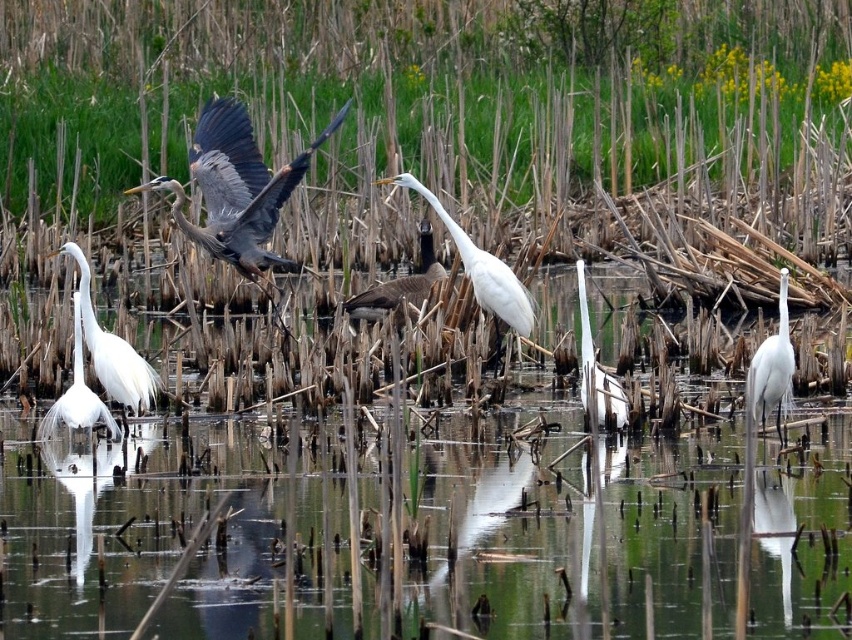
Question: Which object appears farthest from the camera in this image?

Choices:
 (A) white matte heron at center
 (B) white matte egret at lower left

Answer: (B)

Question: Observing the image, what is the correct spatial positioning of white matte egret at lower left in reference to white matte heron at center?

Choices:
 (A) right
 (B) left

Answer: (B)

Question: Which object is closer to the camera taking this photo?

Choices:
 (A) brown matte goose at center
 (B) white matte bird at center
 (C) white smooth heron at right
 (D) clear water at center

Answer: (D)

Question: Is white matte egret at lower left to the right of white matte heron at lower left from the viewer's perspective?

Choices:
 (A) no
 (B) yes

Answer: (B)

Question: Is clear water at center wider than white matte bird at center?

Choices:
 (A) yes
 (B) no

Answer: (A)

Question: Among these objects, which one is farthest from the camera?

Choices:
 (A) gray feathered heron at left
 (B) white matte heron at lower left

Answer: (A)